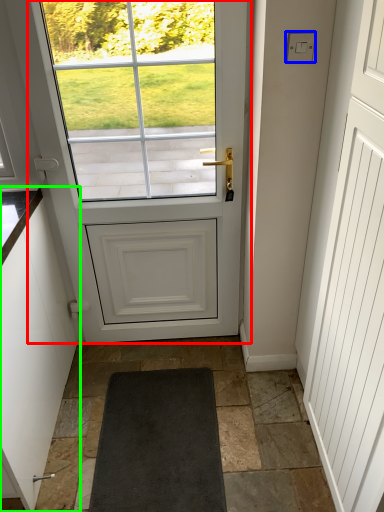
Question: Estimate the real-world distances between objects in this image. Which object is closer to door (highlighted by a red box), lock (highlighted by a blue box) or cabinetry (highlighted by a green box)?

Choices:
 (A) lock
 (B) cabinetry

Answer: (B)